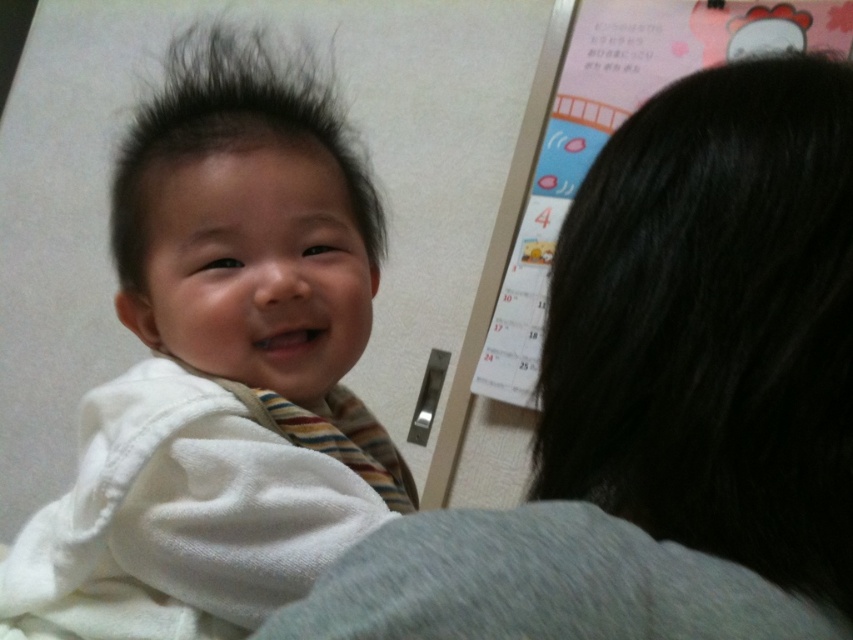
You are a photographer setting up for a baby photo shoot. You notice the gray fabric at upper left and the white soft fabric baby at center. Which object is positioned lower in the frame?

The gray fabric at upper left is located below the white soft fabric baby at center, so it is positioned lower in the frame.

In the scene, there is a gray fabric at upper left and a white soft fabric baby at center. Which object takes up more space in the image?

The white soft fabric baby at center takes up more space in the image because it is larger than the gray fabric at upper left.

You need to place a sticker on the white soft fabric baby at center and the dark brown fuzzy hair at upper left. Which object requires a smaller sticker in terms of width?

The white soft fabric baby at center requires a smaller sticker because it has a lesser width compared to the dark brown fuzzy hair at upper left.